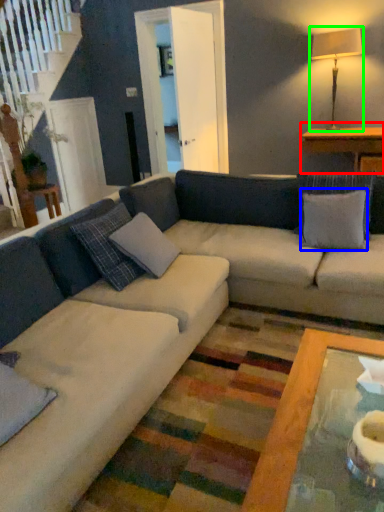
Question: Which object is the closest to the table (highlighted by a red box)? Choose among these: pillow (highlighted by a blue box) or table lamp (highlighted by a green box).

Choices:
 (A) pillow
 (B) table lamp

Answer: (B)